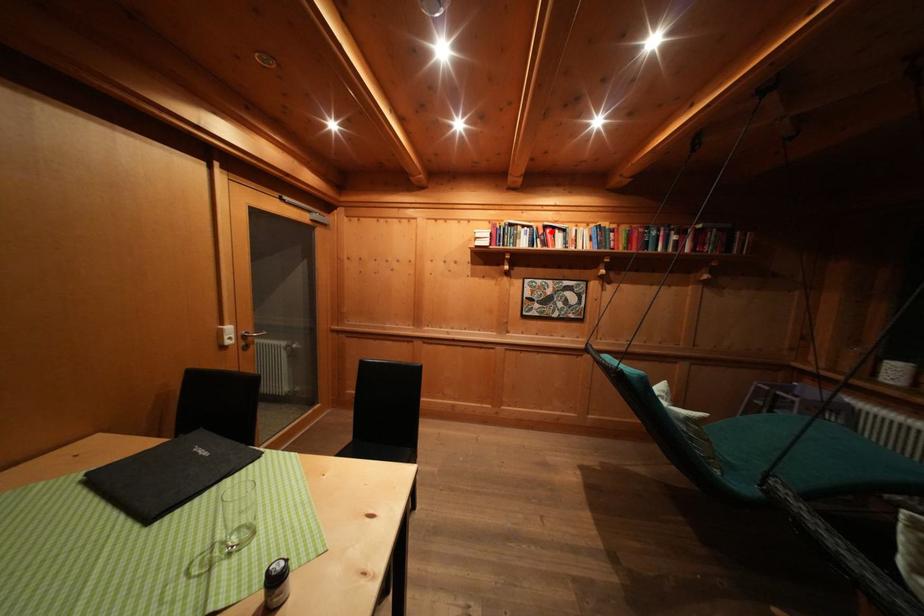
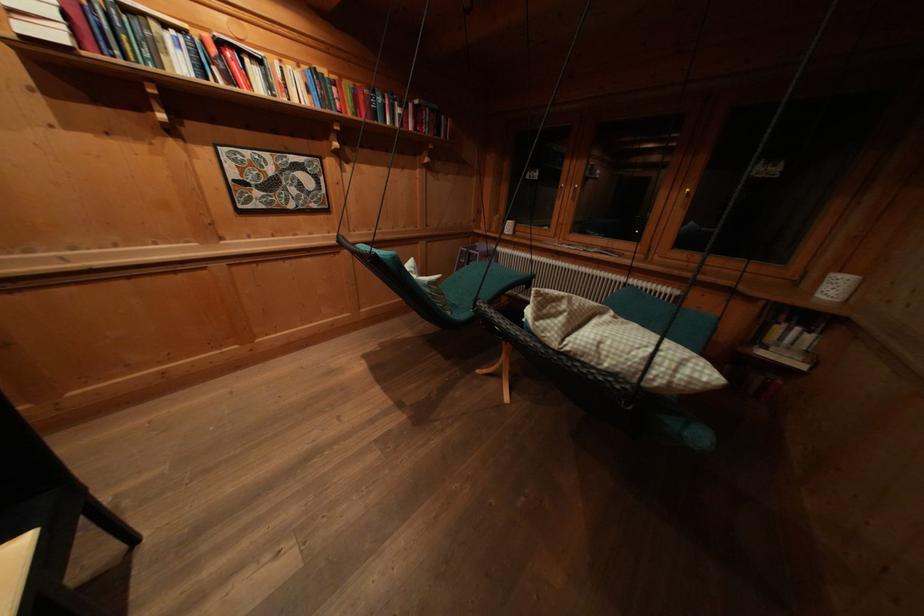
The point at the highlighted location is marked in the first image. Where is the corresponding point in the second image?

(225, 47)